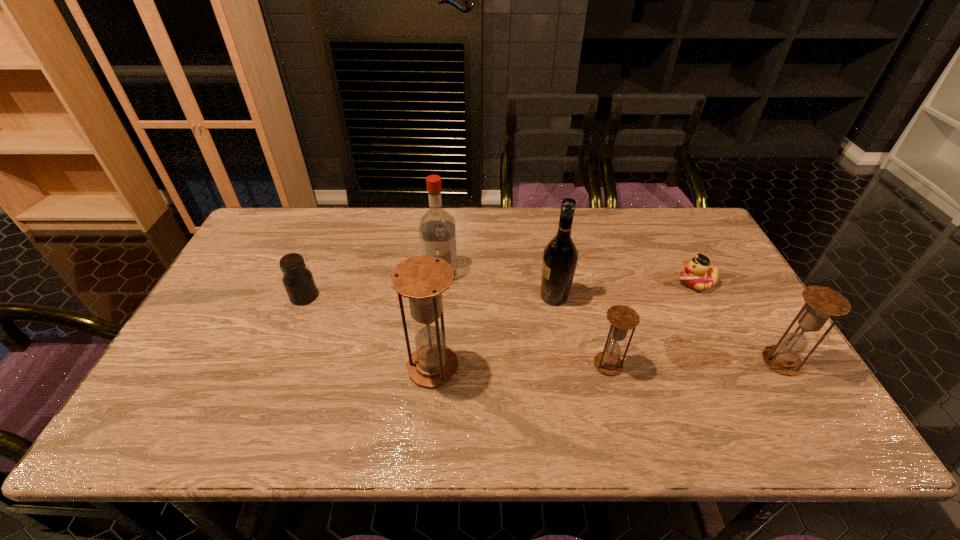
You are a GUI agent. You are given a task and a screenshot of the screen. Output one action in this format:
    pyautogui.click(x=<x>, y=<y>)
    Task: Click on the vacant area situated 0.160m on the face of the shortest object
    This screenshot has height=540, width=960.
    Given the screenshot: What is the action you would take?
    pyautogui.click(x=623, y=282)

Locate an element on the screen. This screenshot has height=540, width=960. free space located on the face of the shortest object is located at coordinates (583, 282).

Identify the location of hourglass situated at the right edge. This screenshot has width=960, height=540. (822, 302).

Where is `duck that is at the right edge`? The height and width of the screenshot is (540, 960). duck that is at the right edge is located at coordinates (696, 274).

Where is `object located at the near right corner`? Image resolution: width=960 pixels, height=540 pixels. object located at the near right corner is located at coordinates (822, 302).

The width and height of the screenshot is (960, 540). I want to click on vacant space at the far edge of the desktop, so click(540, 245).

At what (x,y) coordinates should I click in order to perform the action: click on vacant space at the near edge of the desktop. Please return your answer as a coordinate pair (x, y). Looking at the image, I should click on (473, 374).

Locate an element on the screen. vacant space at the left edge is located at coordinates (234, 309).

Where is `free region at the far left corner of the desktop`? free region at the far left corner of the desktop is located at coordinates (294, 211).

The image size is (960, 540). Find the location of `vacant space at the far right corner`. vacant space at the far right corner is located at coordinates (662, 218).